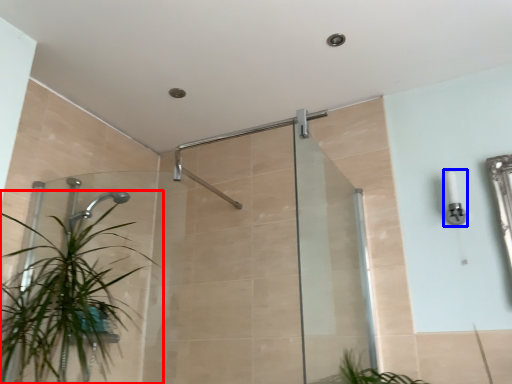
Question: Which object appears farthest to the camera in this image, houseplant (highlighted by a red box) or light fixture (highlighted by a blue box)?

Choices:
 (A) houseplant
 (B) light fixture

Answer: (B)